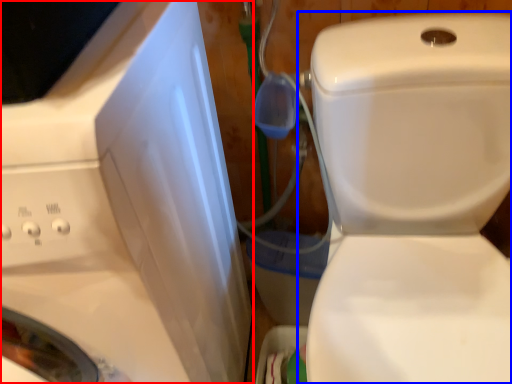
Question: Which object is further to the camera taking this photo, washing machine (highlighted by a red box) or toilet (highlighted by a blue box)?

Choices:
 (A) washing machine
 (B) toilet

Answer: (B)